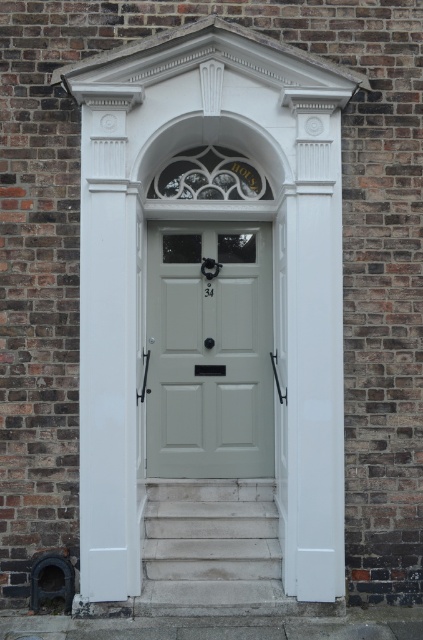
You are standing in front of the door and want to determine which of the two points is closer to you. The points are point (178, 337) and point (257, 538). Which point is closer to you?

Point (178, 337) is further to the viewer than point (257, 538), so the closer point to you is point (257, 538).

You are standing in front of the entrance and want to know if the satin white door at center can be seen above the white stone stairs at lower center. Based on their heights, what do you think?

The satin white door at center is taller than the white stone stairs at lower center, so yes, the door can be seen above the stairs.

You are standing in front of the satin white door at center and want to walk down to the white stone stairs at lower center. Which direction should you move relative to the door?

The satin white door at center is closer to you than the white stone stairs at lower center, so you should move forward towards the white stone stairs at lower center to descend.